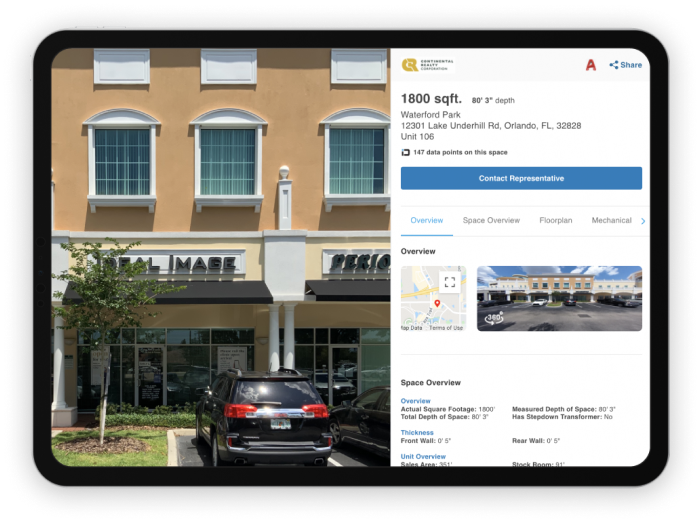
Locate an element on the screen. The height and width of the screenshot is (523, 700). front wall measurement is located at coordinates (421, 438).